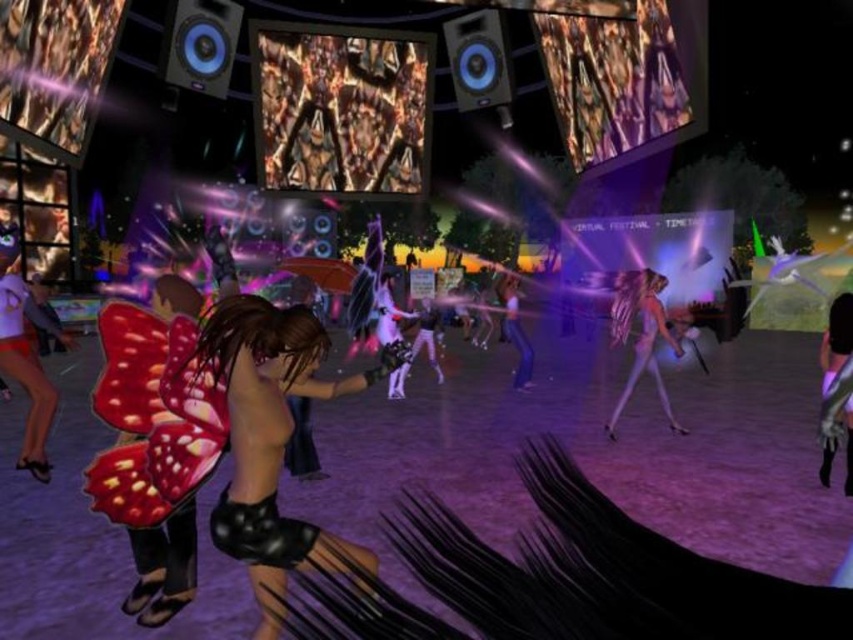
Does shiny black shorts at center appear on the left side of translucent purple hair at center?

Indeed, shiny black shorts at center is positioned on the left side of translucent purple hair at center.

Between shiny black shorts at center and translucent purple hair at center, which one appears on the right side from the viewer's perspective?

Positioned to the right is translucent purple hair at center.

What do you see at coordinates (271, 440) in the screenshot? The image size is (853, 640). I see `shiny black shorts at center` at bounding box center [271, 440].

Find the location of a particular element. shiny black shorts at center is located at coordinates (271, 440).